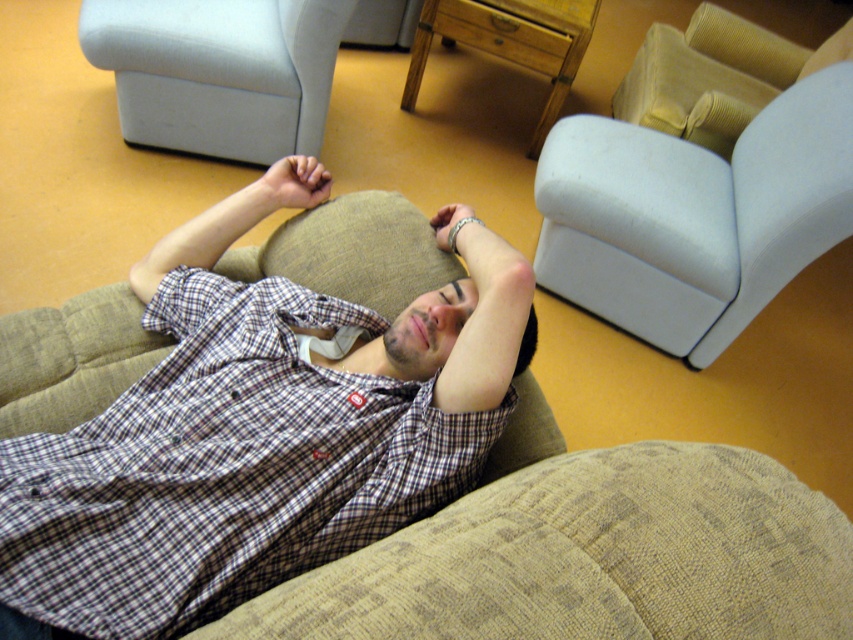
Does checkered fabric shirt at center have a smaller size compared to textured beige armchair at upper right?

Yes, checkered fabric shirt at center is smaller than textured beige armchair at upper right.

Identify the location of checkered fabric shirt at center. (258, 429).

You are a GUI agent. You are given a task and a screenshot of the screen. Output one action in this format:
    pyautogui.click(x=<x>, y=<y>)
    Task: Click on the checkered fabric shirt at center
    
    Given the screenshot: What is the action you would take?
    pyautogui.click(x=258, y=429)

Is light gray fabric armchair at upper left bigger than textured beige armchair at upper right?

Incorrect, light gray fabric armchair at upper left is not larger than textured beige armchair at upper right.

Is light gray fabric armchair at upper left positioned at the back of textured beige armchair at upper right?

No.

Where is `light gray fabric armchair at upper left`? The width and height of the screenshot is (853, 640). light gray fabric armchair at upper left is located at coordinates (218, 72).

Where is `light gray fabric armchair at upper left`? The height and width of the screenshot is (640, 853). light gray fabric armchair at upper left is located at coordinates (218, 72).

Who is taller, white fabric armchair at upper right or textured beige armchair at upper right?

With more height is white fabric armchair at upper right.

Which is behind, point (657, 198) or point (761, 56)?

Point (761, 56)

Image resolution: width=853 pixels, height=640 pixels. Identify the location of white fabric armchair at upper right. (694, 216).